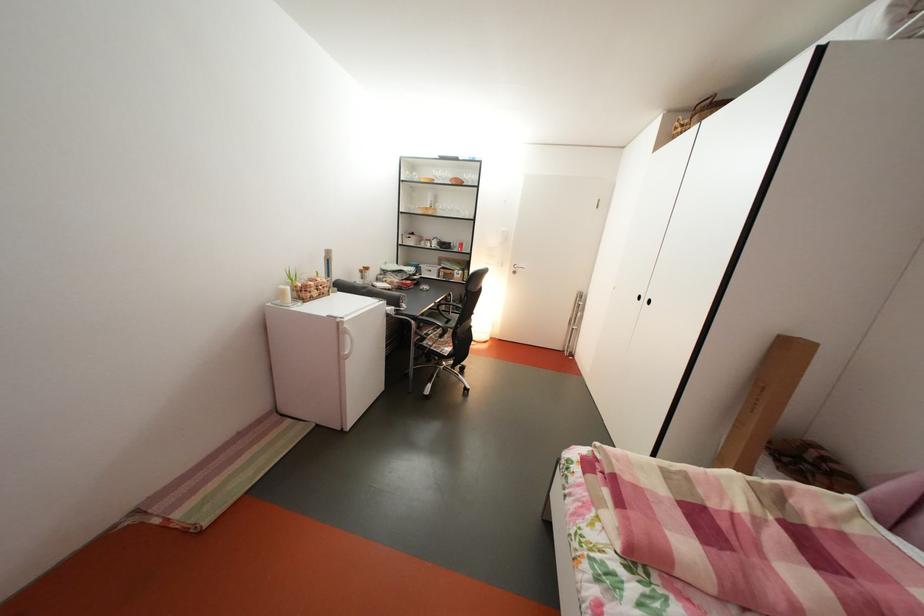
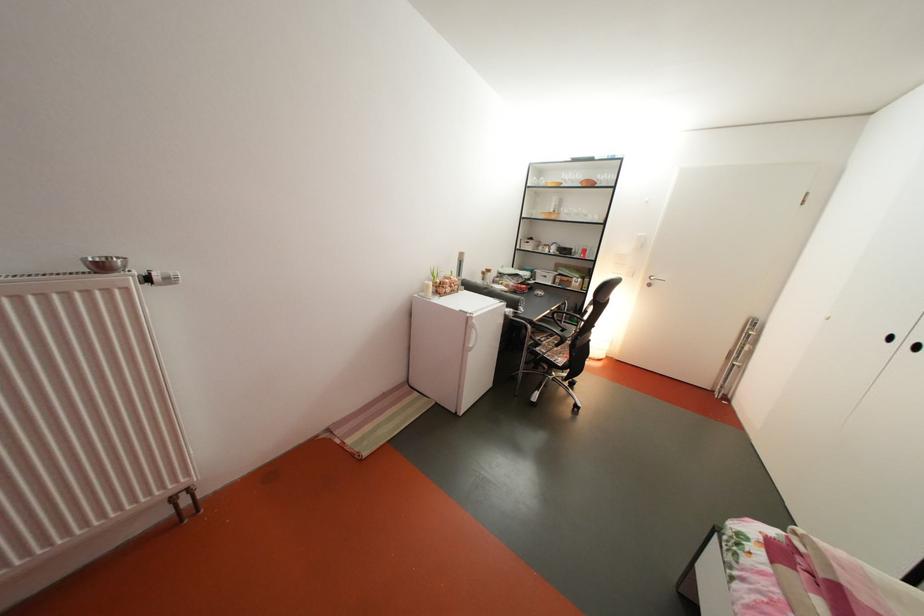
Locate, in the second image, the point that corresponds to pixel 346 331 in the first image.

(477, 326)